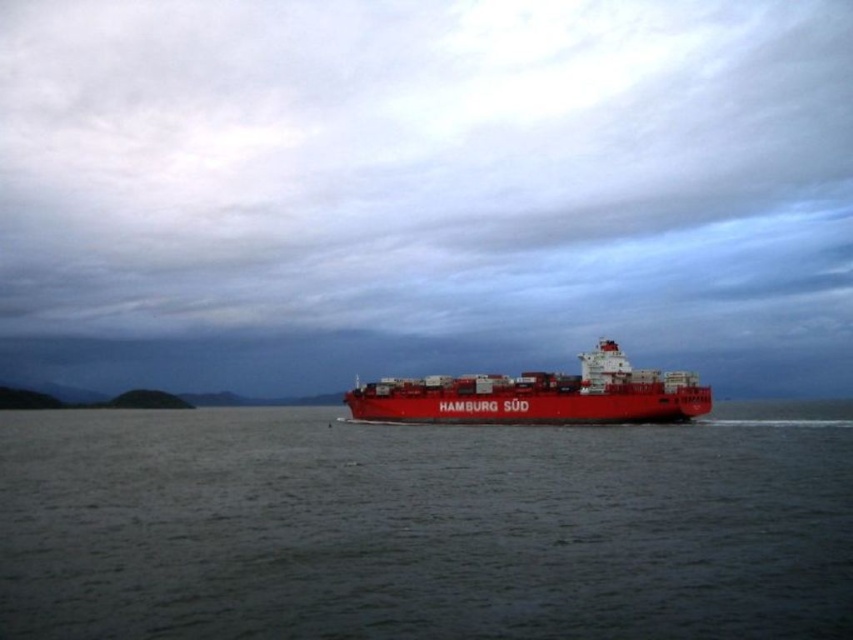
You are a drone operator tasked with capturing aerial footage of the dark gray water at center and the matte red container ship at center. To ensure both are visible in the same frame, should you adjust your drone to fly higher or lower? Explain your reasoning based on their relative heights.

The dark gray water at center has a lesser height compared to the matte red container ship at center. To capture both in the same frame, you should fly the drone higher so that the drone can encompass both the lower water and the taller ship within the camera view.

You are a photographer trying to capture the matte red container ship at center from the shore. You notice the dark gray water at center in the background. Which object will appear smaller in your photo?

The dark gray water at center will appear smaller in the photo because it has a smaller size compared to the matte red container ship at center.

You are a drone operator trying to capture a photo of the dark gray water at center from above. What are the coordinates you should aim for to ensure the water is centered in your shot?

The coordinates to center the dark gray water at center are point (424,528).